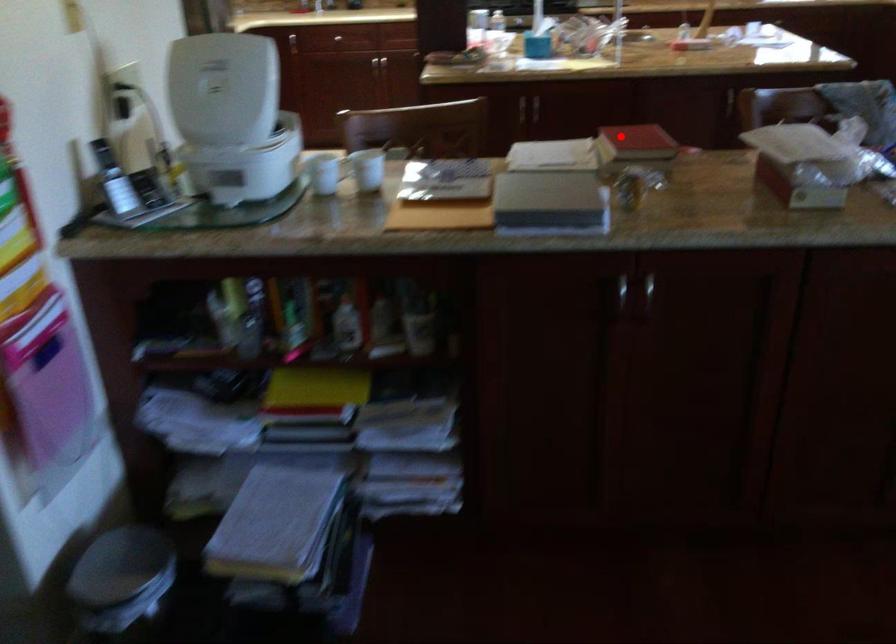
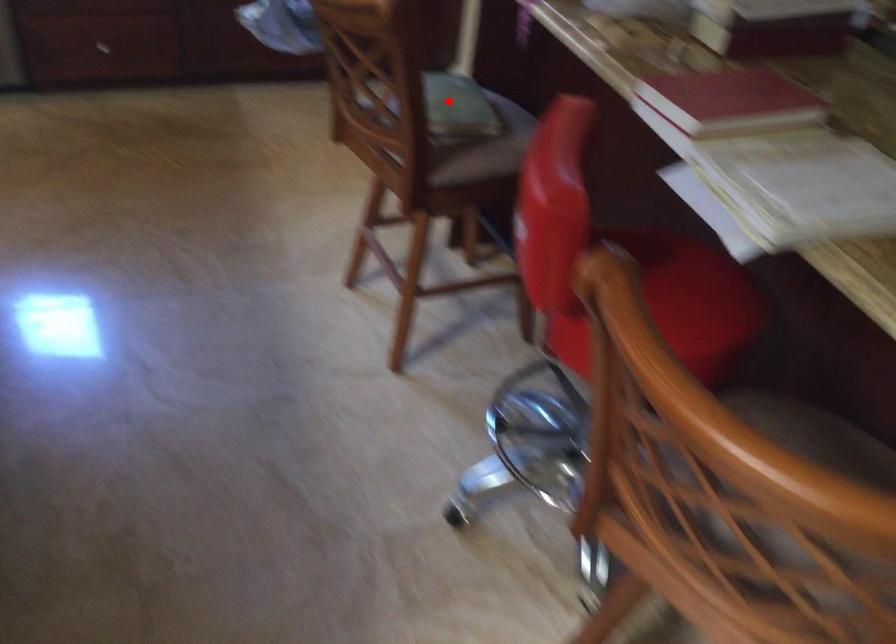
I am providing you with two images of the same scene from different viewpoints. A red point is marked on the first image and another point is marked on the second image. Is the marked point in image1 the same physical position as the marked point in image2?

No